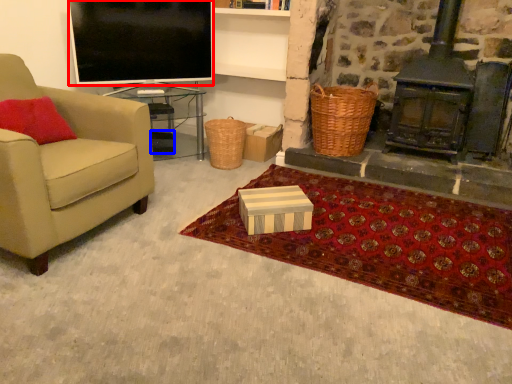
Question: Among these objects, which one is nearest to the camera, television (highlighted by a red box) or box (highlighted by a blue box)?

Choices:
 (A) television
 (B) box

Answer: (A)